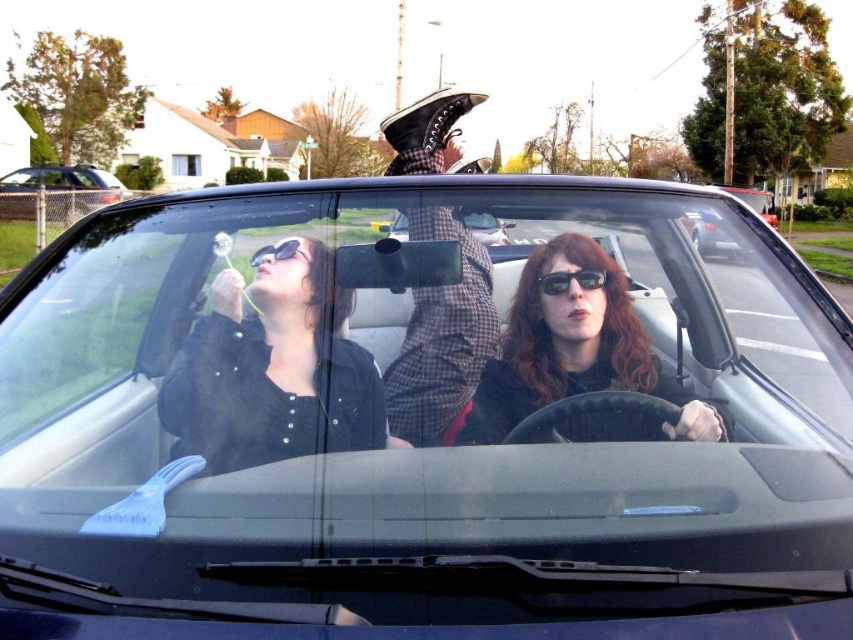
Question: Can you confirm if checkered fabric shirt at center is positioned to the right of black leather car at center?

Choices:
 (A) yes
 (B) no

Answer: (B)

Question: Among these points, which one is farthest from the camera?

Choices:
 (A) (564, 291)
 (B) (450, 436)
 (C) (288, 252)
 (D) (18, 170)

Answer: (D)

Question: Does matte black sunglasses at center have a larger size compared to sunglassesmatte black at upper center?

Choices:
 (A) yes
 (B) no

Answer: (A)

Question: Does matte black sunglasses at center appear on the right side of black leather car at center?

Choices:
 (A) no
 (B) yes

Answer: (A)

Question: Considering the real-world distances, which object is closest to the black leather convertible at center?

Choices:
 (A) checkered fabric shirt at center
 (B) black matte jacket at upper left
 (C) matte black convertible at center

Answer: (B)

Question: Which of the following is the closest to the observer?

Choices:
 (A) matte black sunglasses at center
 (B) sunglassesmatte black at upper center
 (C) matte black convertible at center
 (D) black plastic sunglasses at center

Answer: (A)